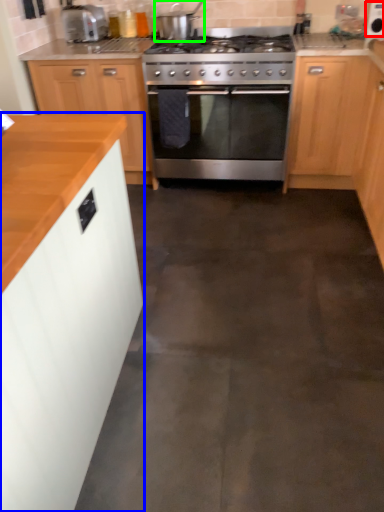
Question: Based on their relative distances, which object is nearer to appliance (highlighted by a red box)? Choose from cabinetry (highlighted by a blue box) and appliance (highlighted by a green box).

Choices:
 (A) cabinetry
 (B) appliance

Answer: (B)